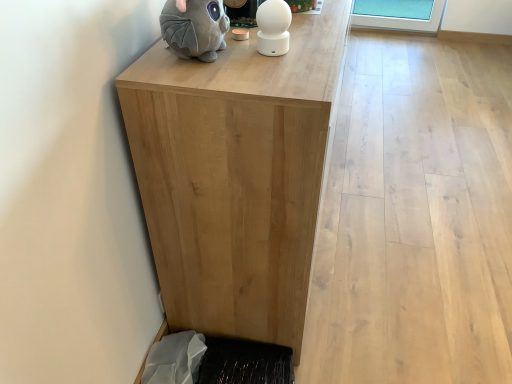
Identify the location of free spot below gray plush toy at upper left (from a real-world perspective). coord(201,60).